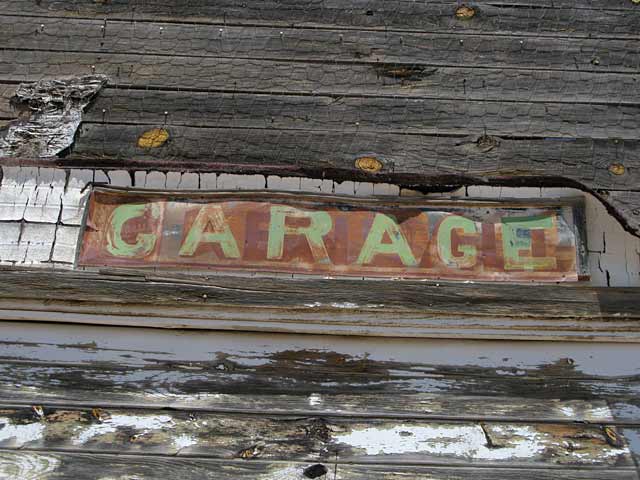
Find the location of `knots in wood`. knots in wood is located at coordinates (410, 73), (484, 144), (248, 452).